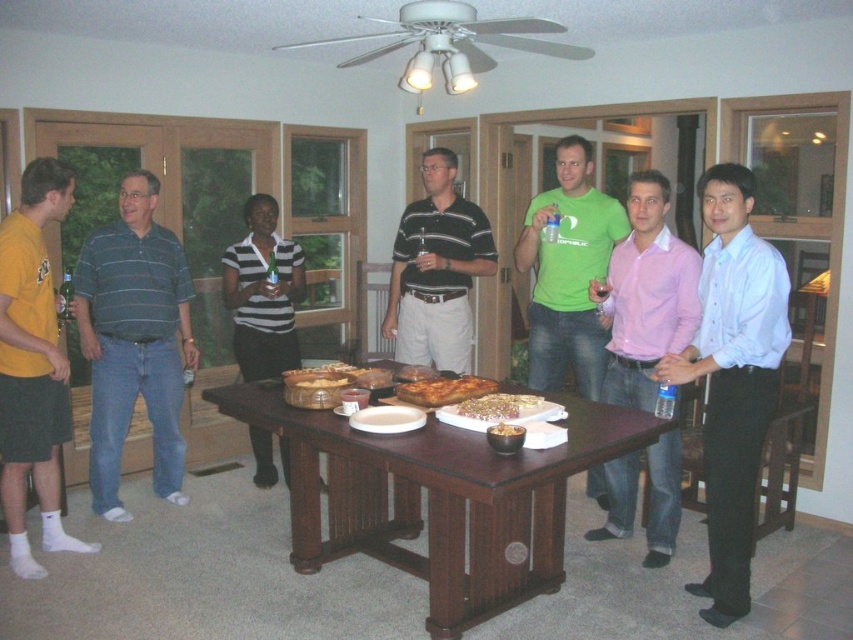
Is brown wood table at center thinner than matte yellow t-shirt at left?

In fact, brown wood table at center might be wider than matte yellow t-shirt at left.

Is brown wood table at center positioned behind matte yellow t-shirt at left?

No, brown wood table at center is closer to the viewer.

The width and height of the screenshot is (853, 640). Describe the element at coordinates (436, 499) in the screenshot. I see `brown wood table at center` at that location.

Where is `brown wood table at center`? brown wood table at center is located at coordinates (436, 499).

Does pink cotton shirt at center appear on the right side of golden crispy bread at center?

Correct, you'll find pink cotton shirt at center to the right of golden crispy bread at center.

Who is taller, pink cotton shirt at center or golden crispy bread at center?

With more height is pink cotton shirt at center.

Find the location of a particular element. Image resolution: width=853 pixels, height=640 pixels. pink cotton shirt at center is located at coordinates (646, 296).

Which is more to the right, matte yellow t-shirt at left or pink cotton shirt at center?

pink cotton shirt at center

Is matte yellow t-shirt at left smaller than pink cotton shirt at center?

Indeed, matte yellow t-shirt at left has a smaller size compared to pink cotton shirt at center.

You are a GUI agent. You are given a task and a screenshot of the screen. Output one action in this format:
    pyautogui.click(x=<x>, y=<y>)
    Task: Click on the matte yellow t-shirt at left
    The width and height of the screenshot is (853, 640).
    Given the screenshot: What is the action you would take?
    pyautogui.click(x=33, y=365)